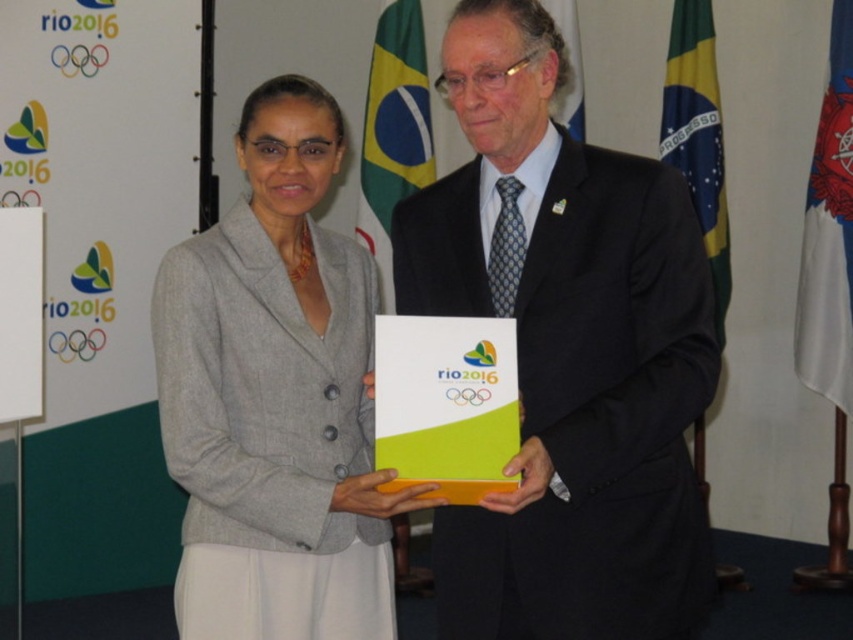
Can you confirm if gray woolen blazer at center is shorter than blue fabric flag at right?

Yes.

The width and height of the screenshot is (853, 640). In order to click on gray woolen blazer at center in this screenshot , I will do `click(276, 397)`.

Can you confirm if black suit at center is shorter than gray woolen blazer at center?

No.

Does point (581, 346) come behind point (318, 589)?

That is False.

At what (x,y) coordinates should I click in order to perform the action: click on black suit at center. Please return your answer as a coordinate pair (x, y). The height and width of the screenshot is (640, 853). Looking at the image, I should click on pyautogui.click(x=566, y=353).

Find the location of a particular element. black suit at center is located at coordinates (566, 353).

Who is taller, gray woolen blazer at center or yellowmaterial/textureflag at right?

yellowmaterial/textureflag at right

Is the position of gray woolen blazer at center more distant than that of yellowmaterial/textureflag at right?

No, it is not.

Describe the element at coordinates (276, 397) in the screenshot. I see `gray woolen blazer at center` at that location.

Where is `gray woolen blazer at center`? gray woolen blazer at center is located at coordinates (276, 397).